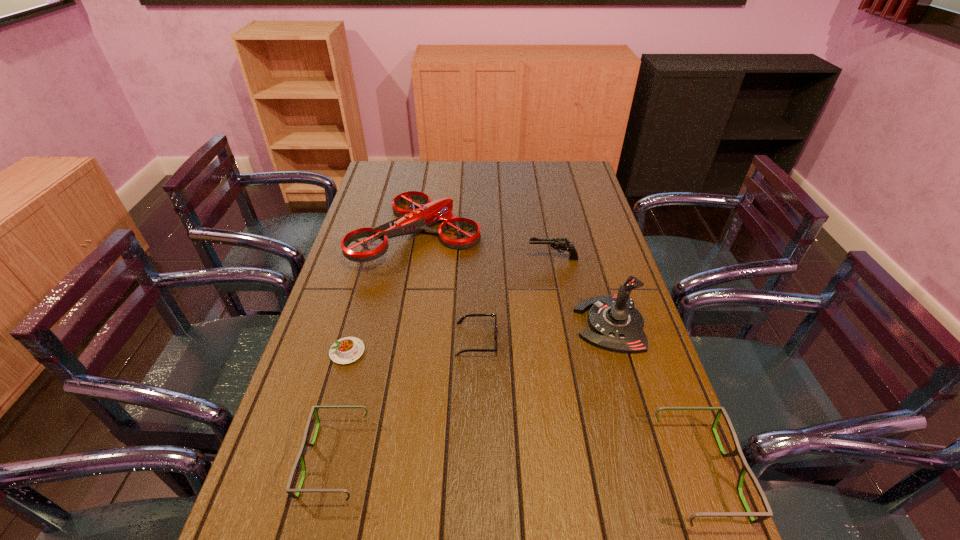
The width and height of the screenshot is (960, 540). Find the location of `spectacles that is at the right edge`. spectacles that is at the right edge is located at coordinates (763, 516).

Identify the location of gun at the right edge. Image resolution: width=960 pixels, height=540 pixels. (560, 244).

Locate an element on the screen. joystick located in the right edge section of the desktop is located at coordinates (616, 325).

Identify the location of object at the near left corner. (300, 456).

Identify the location of object that is at the near right corner. [763, 516].

Locate an element on the screen. This screenshot has height=540, width=960. free space at the far edge of the desktop is located at coordinates (444, 161).

You are a GUI agent. You are given a task and a screenshot of the screen. Output one action in this format:
    pyautogui.click(x=<x>, y=<y>)
    Task: Click on the vacant space at the near edge of the desktop
    The width and height of the screenshot is (960, 540).
    Given the screenshot: What is the action you would take?
    pyautogui.click(x=573, y=500)

The height and width of the screenshot is (540, 960). Identify the location of free space at the left edge of the desktop. (365, 226).

Locate an element on the screen. free space at the right edge of the desktop is located at coordinates (612, 269).

At what (x,y) coordinates should I click in order to perform the action: click on vacant region at the far left corner of the desktop. Please return your answer as a coordinate pair (x, y). Looking at the image, I should click on point(372,176).